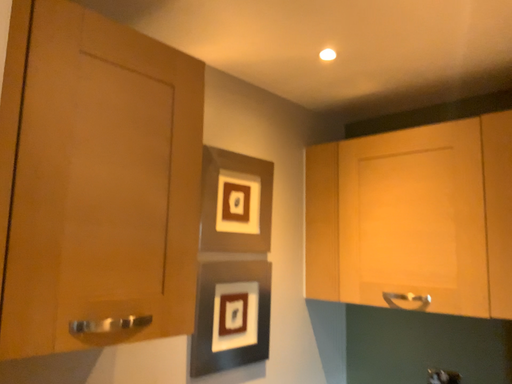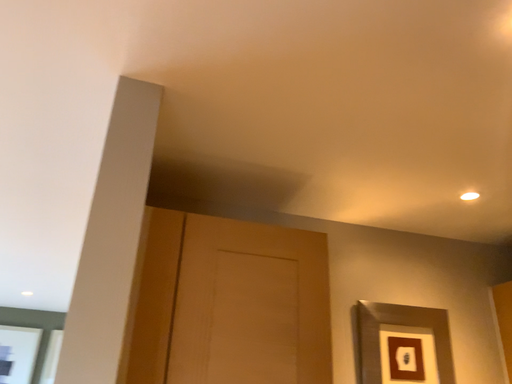
Question: How did the camera likely rotate when shooting the video?

Choices:
 (A) rotated left
 (B) rotated right

Answer: (A)